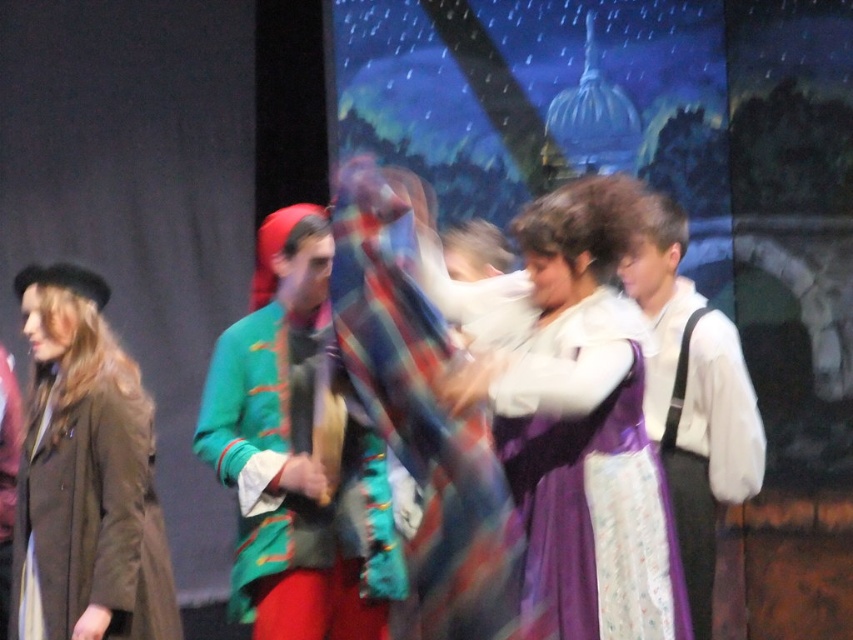
Is matte purple dress at center shorter than matte brown coat at left?

Indeed, matte purple dress at center has a lesser height compared to matte brown coat at left.

Looking at this image, is matte purple dress at center smaller than matte brown coat at left?

Indeed, matte purple dress at center has a smaller size compared to matte brown coat at left.

Between point (561, 282) and point (79, 369), which one is positioned in front?

Point (561, 282) is in front.

The height and width of the screenshot is (640, 853). I want to click on matte purple dress at center, so click(585, 426).

Does point (613, 563) lie in front of point (280, 365)?

Yes, point (613, 563) is closer to viewer.

Locate an element on the screen. The height and width of the screenshot is (640, 853). matte purple dress at center is located at coordinates (585, 426).

Find the location of a particular element. Image resolution: width=853 pixels, height=640 pixels. matte purple dress at center is located at coordinates (585, 426).

Which is below, green velvet jacket at center or matte brown coat at left?

matte brown coat at left

Does point (258, 417) come farther from viewer compared to point (125, 529)?

Yes, it is behind point (125, 529).

Which is behind, point (361, 477) or point (113, 484)?

The point (361, 477) is more distant.

What are the coordinates of `green velvet jacket at center` in the screenshot? It's located at (293, 461).